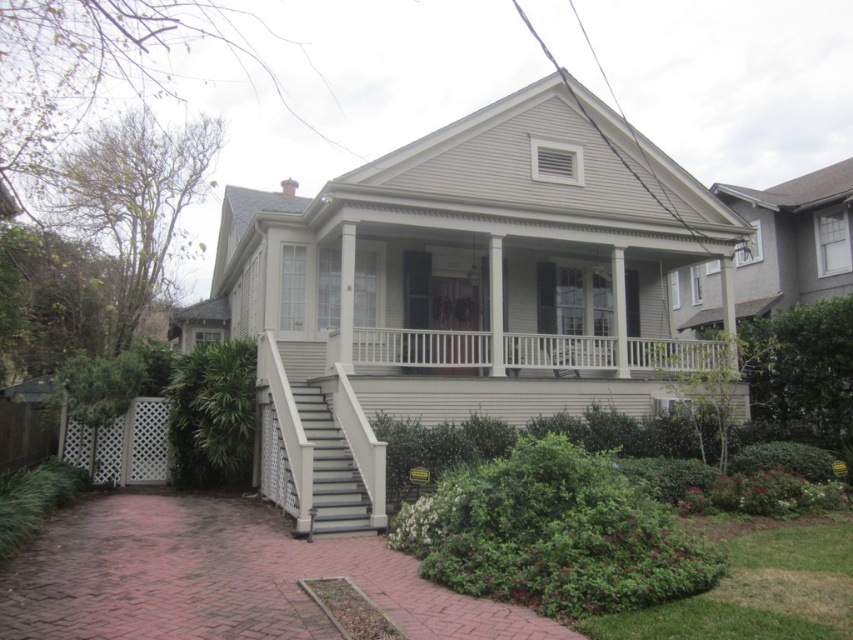
How far apart are smooth gray porch at center and gray painted wood stairs at lower left?

The distance of smooth gray porch at center from gray painted wood stairs at lower left is 4.93 feet.

Is point (428, 406) positioned after point (357, 412)?

That is True.

Identify the location of smooth gray porch at center. (456, 401).

Locate an element on the screen. Image resolution: width=853 pixels, height=640 pixels. smooth gray porch at center is located at coordinates (456, 401).